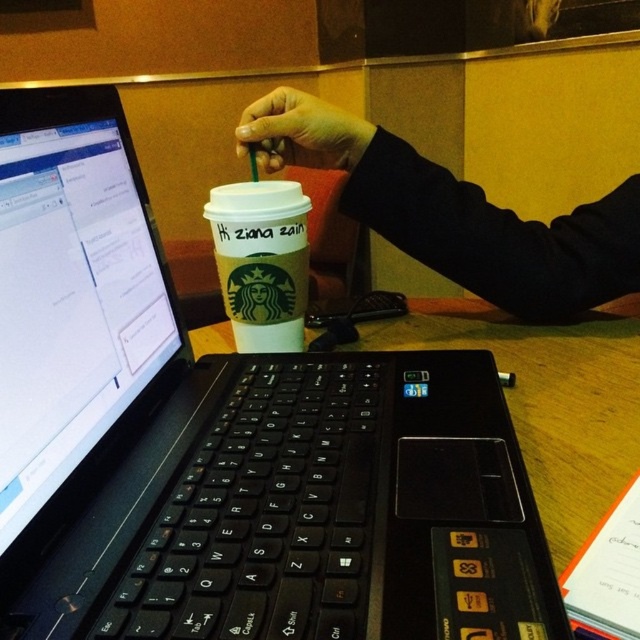
You are a robotic arm trying to reach the wooden table at center from the smooth skin hand at upper center. Can you reach it if your maximum extension is 25 centimeters?

The distance between the wooden table at center and the smooth skin hand at upper center is 27.45 centimeters, which is longer than the robotic arm maximum extension of 25 centimeters. Therefore, the robotic arm cannot reach the wooden table at center from the smooth skin hand at upper center.

You are a photographer trying to capture the wooden table at center and the smooth skin hand at upper center in the same frame. Based on their positions, which object is closer to the camera?

The smooth skin hand at upper center is closer to the camera because the wooden table at center is positioned on the right side of it, implying it is further away.

You are trying to place a new item on the wooden table at center. What are the coordinates of the table to ensure accurate placement?

The wooden table at center is located at point (548, 397). Place the new item there for accurate placement.